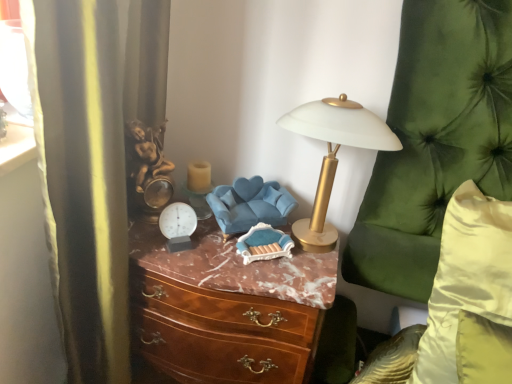
Question: Does blue fabric swivel chair at center have a lesser width compared to silky yellow pillow at right?

Choices:
 (A) yes
 (B) no

Answer: (A)

Question: Is blue fabric swivel chair at center at the left side of silky yellow pillow at right?

Choices:
 (A) yes
 (B) no

Answer: (A)

Question: Is blue fabric swivel chair at center to the right of silky yellow pillow at right from the viewer's perspective?

Choices:
 (A) no
 (B) yes

Answer: (A)

Question: Considering the relative positions of blue fabric swivel chair at center and silky yellow pillow at right in the image provided, is blue fabric swivel chair at center in front of silky yellow pillow at right?

Choices:
 (A) no
 (B) yes

Answer: (A)

Question: Is blue fabric swivel chair at center far from silky yellow pillow at right?

Choices:
 (A) no
 (B) yes

Answer: (A)

Question: Relative to silky yellow pillow at right, is blue fabric swivel chair at center in front or behind?

Choices:
 (A) front
 (B) behind

Answer: (B)

Question: Visually, is blue fabric swivel chair at center positioned to the left or to the right of silky yellow pillow at right?

Choices:
 (A) left
 (B) right

Answer: (A)

Question: Do you think blue fabric swivel chair at center is within silky yellow pillow at right, or outside of it?

Choices:
 (A) outside
 (B) inside

Answer: (A)

Question: From a real-world perspective, is blue fabric swivel chair at center above or below silky yellow pillow at right?

Choices:
 (A) above
 (B) below

Answer: (A)

Question: Based on their positions, is gold metallic table lamp at upper center located to the left or right of blue fabric swivel chair at center?

Choices:
 (A) left
 (B) right

Answer: (B)

Question: From a real-world perspective, is gold metallic table lamp at upper center positioned above or below blue fabric swivel chair at center?

Choices:
 (A) above
 (B) below

Answer: (A)

Question: Relative to blue fabric swivel chair at center, is gold metallic table lamp at upper center in front or behind?

Choices:
 (A) behind
 (B) front

Answer: (B)

Question: Do you think gold metallic table lamp at upper center is within blue fabric swivel chair at center, or outside of it?

Choices:
 (A) inside
 (B) outside

Answer: (B)

Question: Visually, is translucent glass candle at center positioned to the left or to the right of silky yellow pillow at right?

Choices:
 (A) left
 (B) right

Answer: (A)

Question: From a real-world perspective, is translucent glass candle at center positioned above or below silky yellow pillow at right?

Choices:
 (A) below
 (B) above

Answer: (B)